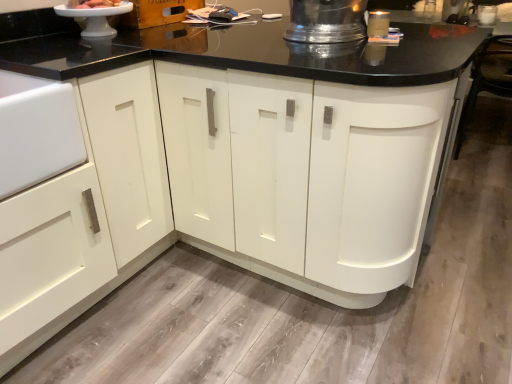
In order to click on white glossy cake at upper left in this screenshot , I will do `click(97, 4)`.

What do you see at coordinates (326, 21) in the screenshot? Image resolution: width=512 pixels, height=384 pixels. I see `shiny metallic pitcher at upper center, the 2th appliance in the left-to-right sequence` at bounding box center [326, 21].

What do you see at coordinates (95, 18) in the screenshot?
I see `white glossy cake stand at upper left, placed as the 1th appliance when sorted from left to right` at bounding box center [95, 18].

You are a GUI agent. You are given a task and a screenshot of the screen. Output one action in this format:
    pyautogui.click(x=<x>, y=<y>)
    Task: Click on the white glossy cake at upper left
    The image size is (512, 384).
    Given the screenshot: What is the action you would take?
    pyautogui.click(x=97, y=4)

Choose the correct answer: Is white glossy cake stand at upper left, placed as the 1th appliance when sorted from left to right, inside shiny metallic pitcher at upper center, placed as the 1th appliance when sorted from right to left, or outside it?

The correct answer is: outside.

Is point (105, 25) in front of point (325, 42)?

No, (105, 25) is further to viewer.

From a real-world perspective, which is physically below, white glossy cake stand at upper left, placed as the 2th appliance when sorted from right to left, or shiny metallic pitcher at upper center, the 2th appliance in the left-to-right sequence?

white glossy cake stand at upper left, placed as the 2th appliance when sorted from right to left, is physically lower.

Are white glossy cake stand at upper left, placed as the 2th appliance when sorted from right to left, and shiny metallic pitcher at upper center, the 2th appliance in the left-to-right sequence, making contact?

white glossy cake stand at upper left, placed as the 2th appliance when sorted from right to left, is not next to shiny metallic pitcher at upper center, the 2th appliance in the left-to-right sequence, and they're not touching.

From a real-world perspective, is shiny metallic pitcher at upper center, placed as the 1th appliance when sorted from right to left, below white glossy cake stand at upper left, placed as the 2th appliance when sorted from right to left?

No.

Based on the photo, considering the relative sizes of shiny metallic pitcher at upper center, the 2th appliance in the left-to-right sequence, and white glossy cake stand at upper left, placed as the 1th appliance when sorted from left to right, in the image provided, is shiny metallic pitcher at upper center, the 2th appliance in the left-to-right sequence, shorter than white glossy cake stand at upper left, placed as the 1th appliance when sorted from left to right,?

No, shiny metallic pitcher at upper center, the 2th appliance in the left-to-right sequence, is not shorter than white glossy cake stand at upper left, placed as the 1th appliance when sorted from left to right.

Is shiny metallic pitcher at upper center, placed as the 1th appliance when sorted from right to left, looking in the opposite direction of white glossy cake stand at upper left, placed as the 2th appliance when sorted from right to left?

That's not correct — shiny metallic pitcher at upper center, placed as the 1th appliance when sorted from right to left, is not looking away from white glossy cake stand at upper left, placed as the 2th appliance when sorted from right to left.

This screenshot has width=512, height=384. Find the location of `appliance below the white glossy cake stand at upper left, placed as the 2th appliance when sorted from right to left (from the image's perspective)`. appliance below the white glossy cake stand at upper left, placed as the 2th appliance when sorted from right to left (from the image's perspective) is located at coordinates (326, 21).

Considering their positions, is white glossy cake at upper left located in front of or behind shiny metallic pitcher at upper center, the 2th appliance in the left-to-right sequence?

Clearly, white glossy cake at upper left is behind shiny metallic pitcher at upper center, the 2th appliance in the left-to-right sequence.

Is white glossy cake at upper left not inside shiny metallic pitcher at upper center, placed as the 1th appliance when sorted from right to left?

Yes, white glossy cake at upper left is located beyond the bounds of shiny metallic pitcher at upper center, placed as the 1th appliance when sorted from right to left.

Is white glossy cake at upper left not near shiny metallic pitcher at upper center, placed as the 1th appliance when sorted from right to left?

No, there isn't a large distance between white glossy cake at upper left and shiny metallic pitcher at upper center, placed as the 1th appliance when sorted from right to left.

How different are the orientations of white glossy cake at upper left and shiny metallic pitcher at upper center, the 2th appliance in the left-to-right sequence, in degrees?

The angle between the facing direction of white glossy cake at upper left and the facing direction of shiny metallic pitcher at upper center, the 2th appliance in the left-to-right sequence, is 90.1 degrees.

Is point (92, 5) behind point (131, 3)?

No, it is in front of (131, 3).

Considering the sizes of objects white glossy cake at upper left and white glossy cake stand at upper left, placed as the 1th appliance when sorted from left to right, in the image provided, who is bigger, white glossy cake at upper left or white glossy cake stand at upper left, placed as the 1th appliance when sorted from left to right,?

white glossy cake stand at upper left, placed as the 1th appliance when sorted from left to right, is bigger.

From the image's perspective, is white glossy cake at upper left positioned above or below white glossy cake stand at upper left, placed as the 1th appliance when sorted from left to right?

Based on their image positions, white glossy cake at upper left is located above white glossy cake stand at upper left, placed as the 1th appliance when sorted from left to right.

Considering the relative sizes of white glossy cake at upper left and white glossy cake stand at upper left, placed as the 1th appliance when sorted from left to right, in the image provided, is white glossy cake at upper left taller than white glossy cake stand at upper left, placed as the 1th appliance when sorted from left to right,?

In fact, white glossy cake at upper left may be shorter than white glossy cake stand at upper left, placed as the 1th appliance when sorted from left to right.

Choose the correct answer: Is white glossy cake stand at upper left, placed as the 1th appliance when sorted from left to right, inside white glossy cake at upper left or outside it?

white glossy cake stand at upper left, placed as the 1th appliance when sorted from left to right, is outside white glossy cake at upper left.

From a real-world perspective, is white glossy cake stand at upper left, placed as the 2th appliance when sorted from right to left, located higher than white glossy cake at upper left?

No.

From the image's perspective, is shiny metallic pitcher at upper center, placed as the 1th appliance when sorted from right to left, over white glossy cake at upper left?

No, from the image's perspective, shiny metallic pitcher at upper center, placed as the 1th appliance when sorted from right to left, is not above white glossy cake at upper left.

From a real-world perspective, who is located higher, shiny metallic pitcher at upper center, placed as the 1th appliance when sorted from right to left, or white glossy cake at upper left?

In real-world perspective, white glossy cake at upper left is above.

Is shiny metallic pitcher at upper center, placed as the 1th appliance when sorted from right to left, not within white glossy cake at upper left?

That's correct, shiny metallic pitcher at upper center, placed as the 1th appliance when sorted from right to left, is outside of white glossy cake at upper left.

How far apart are shiny metallic pitcher at upper center, placed as the 1th appliance when sorted from right to left, and white glossy cake at upper left?

shiny metallic pitcher at upper center, placed as the 1th appliance when sorted from right to left, and white glossy cake at upper left are 32.45 inches apart from each other.

Locate an element on the screen. appliance that is above the shiny metallic pitcher at upper center, the 2th appliance in the left-to-right sequence (from the image's perspective) is located at coordinates (95, 18).

You are a GUI agent. You are given a task and a screenshot of the screen. Output one action in this format:
    pyautogui.click(x=<x>, y=<y>)
    Task: Click on the appliance behind the shiny metallic pitcher at upper center, the 2th appliance in the left-to-right sequence
    
    Given the screenshot: What is the action you would take?
    pyautogui.click(x=95, y=18)

Looking at the image, which one is located further to white glossy cake stand at upper left, placed as the 1th appliance when sorted from left to right, white glossy cake at upper left or shiny metallic pitcher at upper center, placed as the 1th appliance when sorted from right to left?

shiny metallic pitcher at upper center, placed as the 1th appliance when sorted from right to left.

Which object lies nearer to the anchor point shiny metallic pitcher at upper center, placed as the 1th appliance when sorted from right to left, white glossy cake stand at upper left, placed as the 2th appliance when sorted from right to left, or white glossy cake at upper left?

Among the two, white glossy cake stand at upper left, placed as the 2th appliance when sorted from right to left, is located nearer to shiny metallic pitcher at upper center, placed as the 1th appliance when sorted from right to left.

Based on their spatial positions, is shiny metallic pitcher at upper center, the 2th appliance in the left-to-right sequence, or white glossy cake at upper left further from white glossy cake stand at upper left, placed as the 1th appliance when sorted from left to right?

shiny metallic pitcher at upper center, the 2th appliance in the left-to-right sequence, is positioned further to the anchor white glossy cake stand at upper left, placed as the 1th appliance when sorted from left to right.

Looking at the image, which one is located further to white glossy cake at upper left, shiny metallic pitcher at upper center, placed as the 1th appliance when sorted from right to left, or white glossy cake stand at upper left, placed as the 1th appliance when sorted from left to right?

Among the two, shiny metallic pitcher at upper center, placed as the 1th appliance when sorted from right to left, is located further to white glossy cake at upper left.

From the image, which object appears to be farther from shiny metallic pitcher at upper center, placed as the 1th appliance when sorted from right to left, white glossy cake at upper left or white glossy cake stand at upper left, placed as the 1th appliance when sorted from left to right?

white glossy cake at upper left is further to shiny metallic pitcher at upper center, placed as the 1th appliance when sorted from right to left.

From the image, which object appears to be farther from white glossy cake at upper left, white glossy cake stand at upper left, placed as the 2th appliance when sorted from right to left, or shiny metallic pitcher at upper center, the 2th appliance in the left-to-right sequence?

shiny metallic pitcher at upper center, the 2th appliance in the left-to-right sequence, lies further to white glossy cake at upper left than the other object.

Identify the location of food between white glossy cake stand at upper left, placed as the 1th appliance when sorted from left to right, and shiny metallic pitcher at upper center, the 2th appliance in the left-to-right sequence, from left to right. Image resolution: width=512 pixels, height=384 pixels. (97, 4).